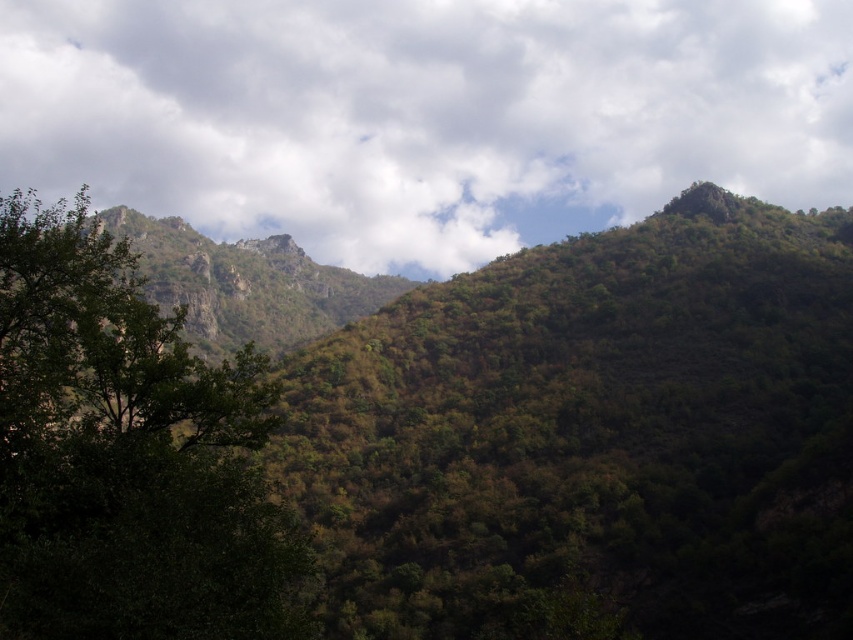
Does green leafy forest at upper center have a larger size compared to white fluffy cloud at upper center?

Actually, green leafy forest at upper center might be smaller than white fluffy cloud at upper center.

Between point (622, 532) and point (76, 186), which one is positioned behind?

The point (76, 186) is behind.

Is point (483, 579) closer to viewer compared to point (660, 42)?

Yes.

The image size is (853, 640). Find the location of `green leafy forest at upper center`. green leafy forest at upper center is located at coordinates (439, 442).

Is point (288, 182) farther from viewer compared to point (86, 435)?

Yes, point (288, 182) is behind point (86, 435).

Which is below, white fluffy cloud at upper center or green leafy tree at left?

green leafy tree at left

Is point (598, 122) closer to camera compared to point (50, 243)?

No, (598, 122) is behind (50, 243).

The image size is (853, 640). I want to click on white fluffy cloud at upper center, so click(422, 115).

In the scene shown: Which is below, green leafy forest at upper center or green leafy tree at left?

green leafy tree at left is below.

Who is more distant from viewer, [692,237] or [111,518]?

The point [692,237] is behind.

This screenshot has width=853, height=640. Describe the element at coordinates (439, 442) in the screenshot. I see `green leafy forest at upper center` at that location.

Find the location of a particular element. green leafy forest at upper center is located at coordinates (439, 442).